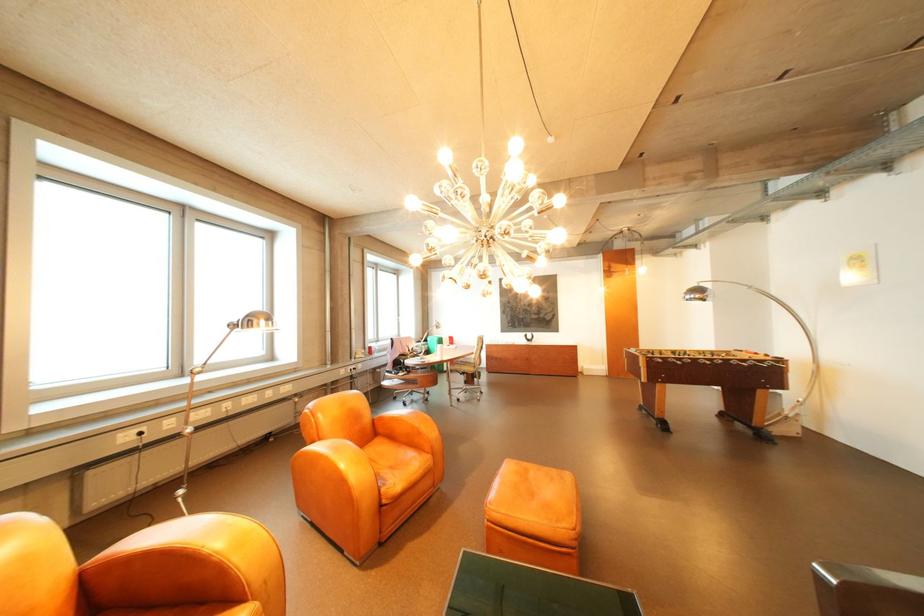
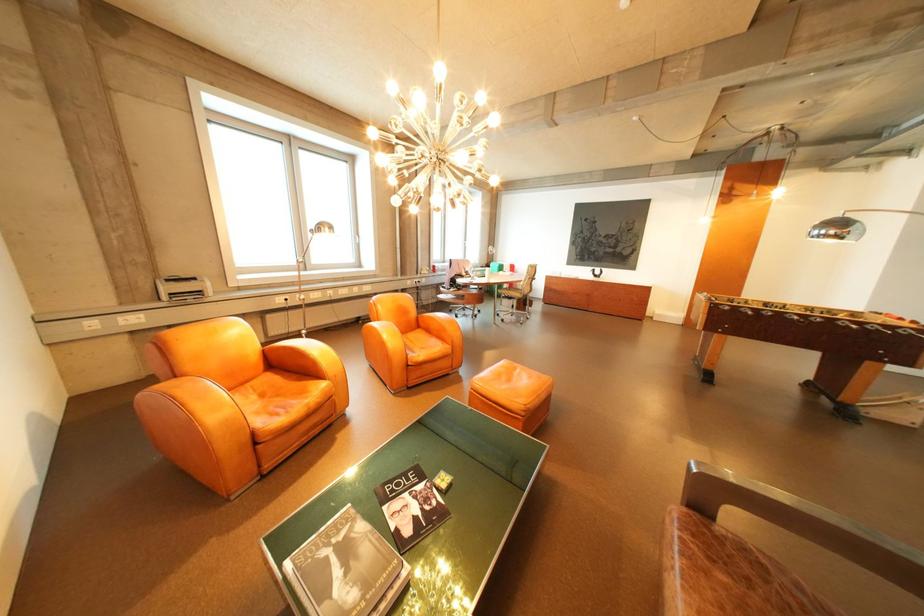
Find the pixel in the second image that matches (x=409, y=357) in the first image.

(467, 276)